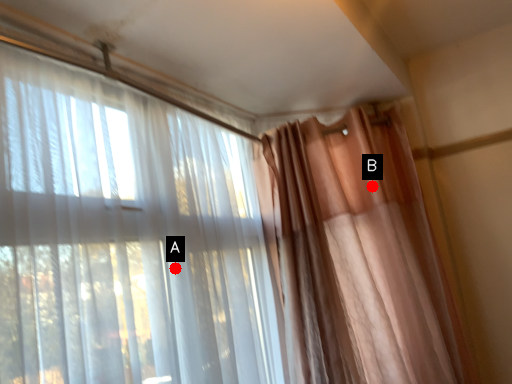
Question: Two points are circled on the image, labeled by A and B beside each circle. Which point appears farthest from the camera in this image?

Choices:
 (A) A is further
 (B) B is further

Answer: (B)